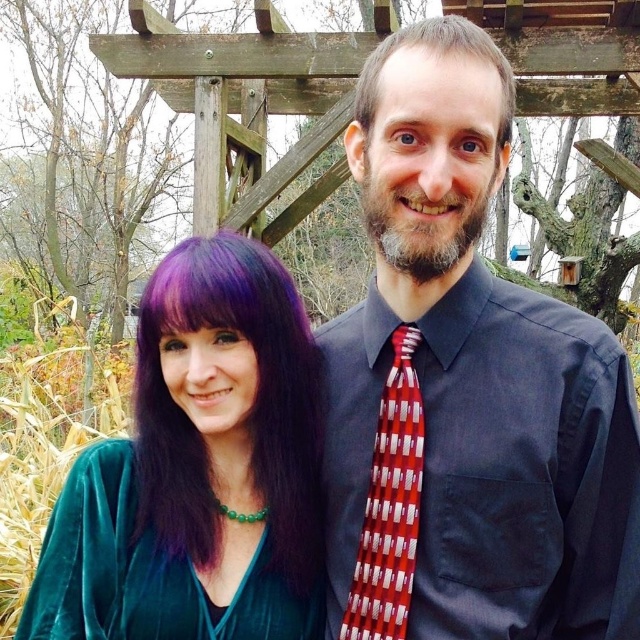
You are a photographer standing 10 feet away from the camera. You want to adjust the focus on the matte black shirt at center. Can you reach it without moving closer?

The matte black shirt at center and camera are 9.02 feet apart from each other. Since you are 10 feet away from the camera, the distance between you and the matte black shirt at center is 10 feet minus 9.02 feet, which is approximately 0.98 feet or about 11.8 inches. Therefore, you can reach the matte black shirt at center without moving closer as the distance is within arm reach.